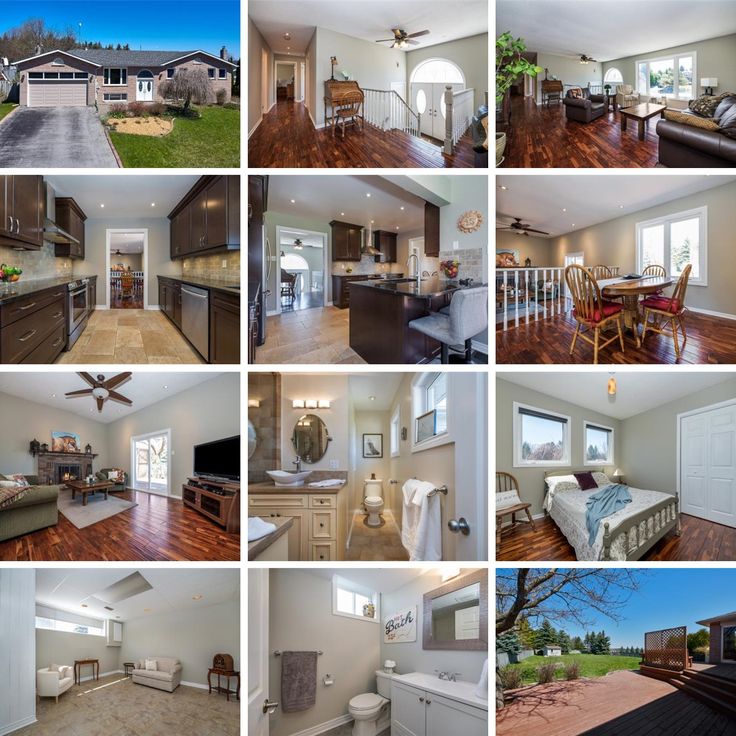
I want to click on white ceilings, so click(662, 29), click(357, 18), click(116, 191), click(325, 191), click(595, 185), click(148, 389), click(361, 377), click(640, 391), click(380, 584), click(71, 581).